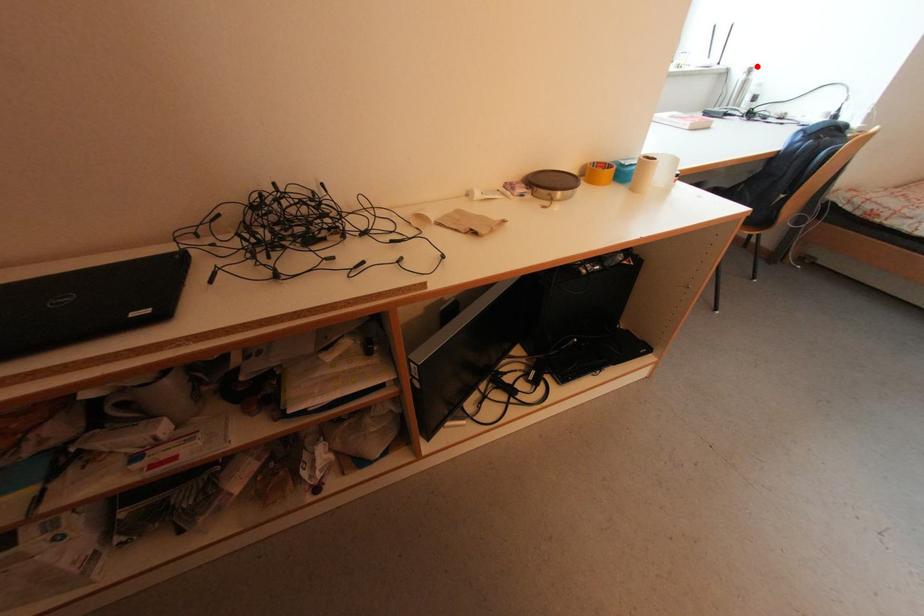
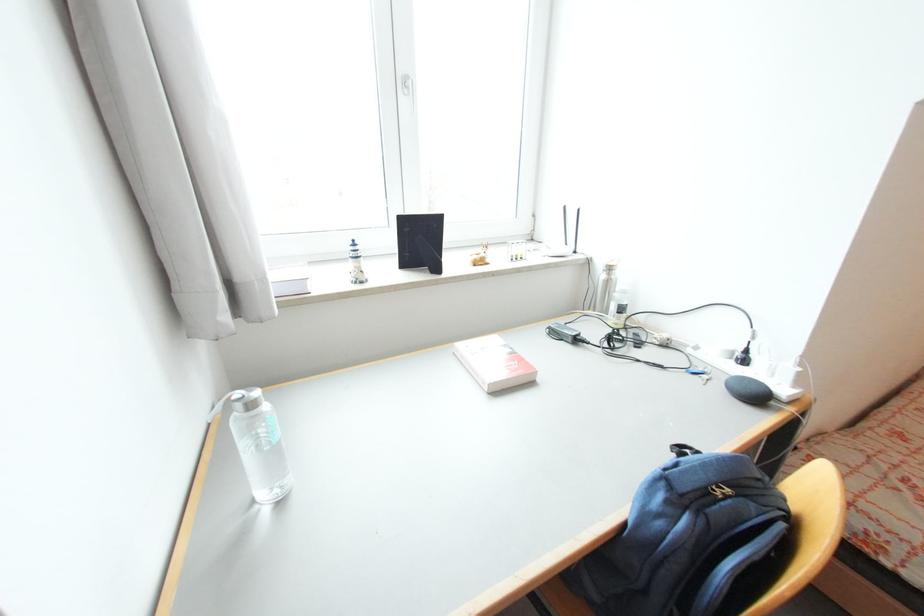
In the second image, find the point that corresponds to the highlighted location in the first image.

(614, 265)